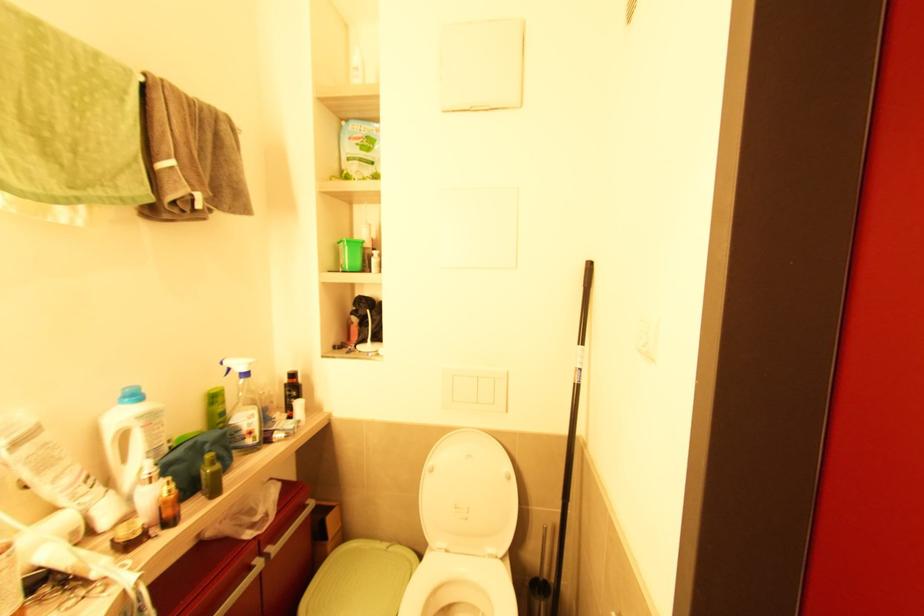
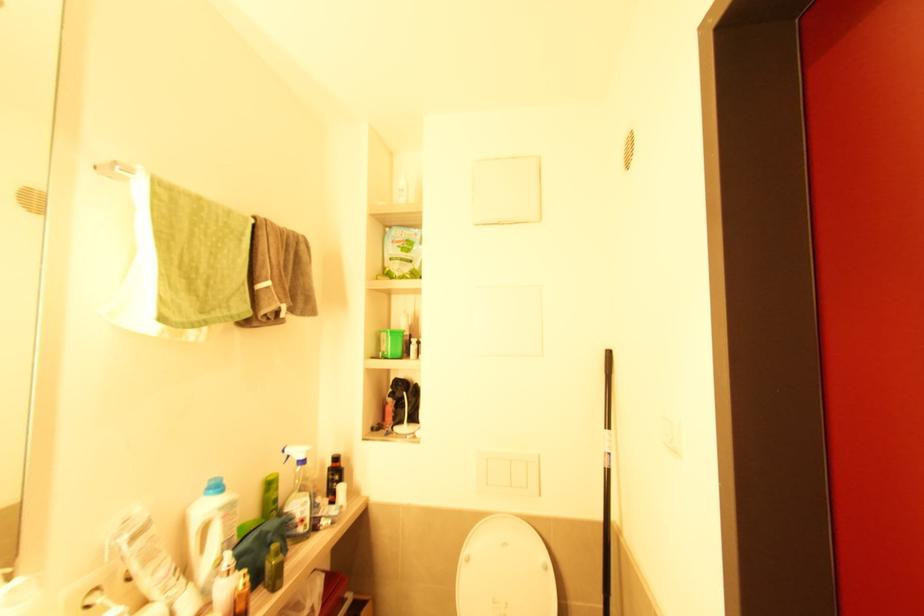
In the second image, find the point that corresponds to the point at 432,472 in the first image.

(469, 561)